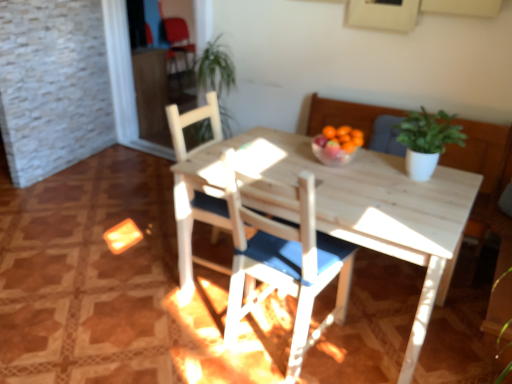
What do you see at coordinates (286, 266) in the screenshot?
I see `white wood chair at center, the second chair when ordered from back to front` at bounding box center [286, 266].

This screenshot has width=512, height=384. What do you see at coordinates (178, 37) in the screenshot?
I see `matte red armchair at upper left` at bounding box center [178, 37].

Image resolution: width=512 pixels, height=384 pixels. In order to click on white wood chair at center, the first chair positioned from the back in this screenshot , I will do `click(192, 227)`.

From the image's perspective, is white wood chair at center, the 1th chair viewed from the front, located beneath matte red armchair at upper left?

Yes, from the image's perspective, white wood chair at center, the 1th chair viewed from the front, is below matte red armchair at upper left.

This screenshot has height=384, width=512. I want to click on armchair behind the white wood chair at center, the 1th chair viewed from the front, so (178, 37).

Based on their positions, is white wood chair at center, the first chair positioned from the back, located to the left or right of green matte plant at upper right?

white wood chair at center, the first chair positioned from the back, is positioned on green matte plant at upper right's left side.

Which object is further away from the camera, white wood chair at center, the first chair positioned from the back, or green matte plant at upper right?

white wood chair at center, the first chair positioned from the back, is more distant.

Considering the relative sizes of white wood chair at center, the first chair positioned from the back, and green matte plant at upper right in the image provided, is white wood chair at center, the first chair positioned from the back, smaller than green matte plant at upper right?

No, white wood chair at center, the first chair positioned from the back, is not smaller than green matte plant at upper right.

Is white wood chair at center, the first chair positioned from the back, spatially inside green matte plant at upper right, or outside of it?

The correct answer is: outside.

From the image's perspective, which one is positioned lower, matte red armchair at upper left or white wood chair at center, the first chair positioned from the back?

white wood chair at center, the first chair positioned from the back, from the image's perspective.

From a real-world perspective, who is located higher, matte red armchair at upper left or white wood chair at center, arranged as the second chair when viewed from the front?

In real-world perspective, white wood chair at center, arranged as the second chair when viewed from the front, is above.

What's the angular difference between matte red armchair at upper left and white wood chair at center, arranged as the second chair when viewed from the front,'s facing directions?

They differ by 10.3 degrees in their facing directions.

Based on the photo, considering the relative sizes of matte red armchair at upper left and white wood chair at center, arranged as the second chair when viewed from the front, in the image provided, is matte red armchair at upper left smaller than white wood chair at center, arranged as the second chair when viewed from the front,?

Actually, matte red armchair at upper left might be larger than white wood chair at center, arranged as the second chair when viewed from the front.

Is point (179, 202) positioned after point (298, 354)?

Yes, point (179, 202) is farther from viewer.

Between white wood chair at center, the first chair positioned from the back, and white wood chair at center, the 1th chair viewed from the front, which one is positioned in front?

white wood chair at center, the 1th chair viewed from the front, is closer to the camera.

Is white wood chair at center, arranged as the second chair when viewed from the front, beside white wood chair at center, the second chair when ordered from back to front?

No, white wood chair at center, arranged as the second chair when viewed from the front, is not next to white wood chair at center, the second chair when ordered from back to front.

Based on the photo, would you say white wood chair at center, arranged as the second chair when viewed from the front, is to the left or to the right of white wood chair at center, the second chair when ordered from back to front, in the picture?

white wood chair at center, arranged as the second chair when viewed from the front, is positioned on white wood chair at center, the second chair when ordered from back to front,'s left side.

Does green matte plant at upper right lie in front of white wood chair at center, arranged as the second chair when viewed from the front?

Yes.

Can you confirm if green matte plant at upper right is thinner than white wood chair at center, arranged as the second chair when viewed from the front?

Yes, green matte plant at upper right is thinner than white wood chair at center, arranged as the second chair when viewed from the front.

Is green matte plant at upper right bigger than white wood chair at center, arranged as the second chair when viewed from the front?

Incorrect, green matte plant at upper right is not larger than white wood chair at center, arranged as the second chair when viewed from the front.

This screenshot has width=512, height=384. I want to click on houseplant in front of the white wood chair at center, arranged as the second chair when viewed from the front, so click(426, 141).

Considering the positions of objects matte red armchair at upper left and green matte plant at upper right in the image provided, who is more to the left, matte red armchair at upper left or green matte plant at upper right?

matte red armchair at upper left is more to the left.

Could you tell me if matte red armchair at upper left is turned towards green matte plant at upper right?

No, matte red armchair at upper left is not oriented towards green matte plant at upper right.

Considering their positions, is matte red armchair at upper left located in front of or behind green matte plant at upper right?

matte red armchair at upper left is behind green matte plant at upper right.

Does matte red armchair at upper left have a smaller size compared to green matte plant at upper right?

Actually, matte red armchair at upper left might be larger than green matte plant at upper right.

Is the depth of white wood chair at center, arranged as the second chair when viewed from the front, greater than that of matte red armchair at upper left?

No, white wood chair at center, arranged as the second chair when viewed from the front, is in front of matte red armchair at upper left.

Is white wood chair at center, arranged as the second chair when viewed from the front, spatially inside matte red armchair at upper left, or outside of it?

white wood chair at center, arranged as the second chair when viewed from the front, is spatially situated outside matte red armchair at upper left.

Which is nearer, (221, 134) or (178, 19)?

Point (221, 134) is positioned closer to the camera compared to point (178, 19).

Can you confirm if white wood chair at center, the first chair positioned from the back, is positioned to the right of matte red armchair at upper left?

Correct, you'll find white wood chair at center, the first chair positioned from the back, to the right of matte red armchair at upper left.

This screenshot has width=512, height=384. What are the coordinates of `armchair behind the white wood chair at center, the 1th chair viewed from the front` in the screenshot? It's located at (178, 37).

At what (x,y) coordinates should I click in order to perform the action: click on the 2nd chair to the left of the green matte plant at upper right, counting from the anchor's position. Please return your answer as a coordinate pair (x, y). Image resolution: width=512 pixels, height=384 pixels. Looking at the image, I should click on (192, 227).

Based on their spatial positions, is white wood chair at center, the 1th chair viewed from the front, or matte red armchair at upper left further from white wood chair at center, the first chair positioned from the back?

matte red armchair at upper left lies further to white wood chair at center, the first chair positioned from the back, than the other object.

Considering their positions, is white wood chair at center, the first chair positioned from the back, positioned closer to matte red armchair at upper left than white wood chair at center, the second chair when ordered from back to front?

white wood chair at center, the first chair positioned from the back.

From the image, which object appears to be nearer to green matte plant at upper right, white wood chair at center, arranged as the second chair when viewed from the front, or matte red armchair at upper left?

white wood chair at center, arranged as the second chair when viewed from the front, is closer to green matte plant at upper right.

Considering their positions, is white wood chair at center, the second chair when ordered from back to front, positioned further to white wood chair at center, the first chair positioned from the back, than green matte plant at upper right?

green matte plant at upper right.

When comparing their distances from green matte plant at upper right, does white wood chair at center, the second chair when ordered from back to front, or white wood chair at center, the first chair positioned from the back, seem closer?

Based on the image, white wood chair at center, the second chair when ordered from back to front, appears to be nearer to green matte plant at upper right.

Which object lies further to the anchor point white wood chair at center, the 1th chair viewed from the front, green matte plant at upper right or white wood chair at center, the first chair positioned from the back?

The object further to white wood chair at center, the 1th chair viewed from the front, is green matte plant at upper right.

Estimate the real-world distances between objects in this image. Which object is closer to white wood chair at center, the 1th chair viewed from the front, white wood chair at center, the first chair positioned from the back, or matte red armchair at upper left?

white wood chair at center, the first chair positioned from the back.

Estimate the real-world distances between objects in this image. Which object is further from white wood chair at center, the second chair when ordered from back to front, matte red armchair at upper left or white wood chair at center, the first chair positioned from the back?

matte red armchair at upper left.

Find the location of `houseplant between white wood chair at center, the 1th chair viewed from the front, and matte red armchair at upper left, along the z-axis`. houseplant between white wood chair at center, the 1th chair viewed from the front, and matte red armchair at upper left, along the z-axis is located at coordinates (426, 141).

Identify the location of chair between green matte plant at upper right and matte red armchair at upper left in the front-back direction. (192, 227).

Identify the location of chair between white wood chair at center, the first chair positioned from the back, and green matte plant at upper right. (286, 266).

This screenshot has height=384, width=512. I want to click on chair located between white wood chair at center, the second chair when ordered from back to front, and matte red armchair at upper left in the depth direction, so click(192, 227).